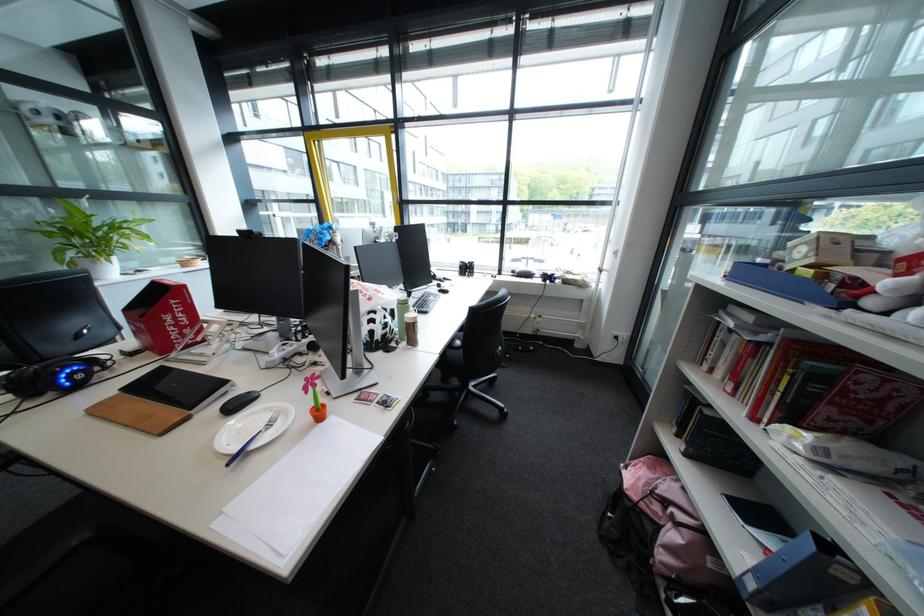
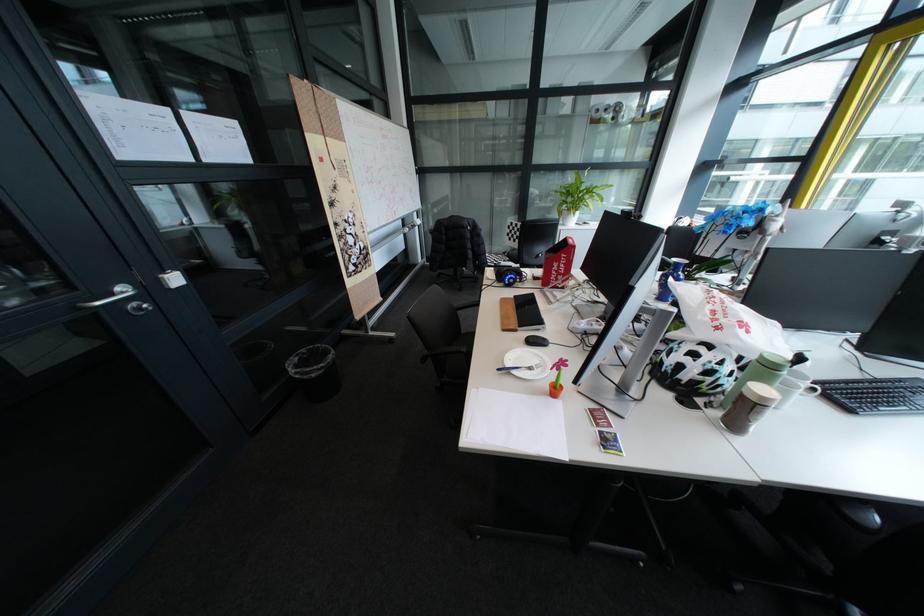
The point at (82, 374) is marked in the first image. Where is the corresponding point in the second image?

(523, 278)